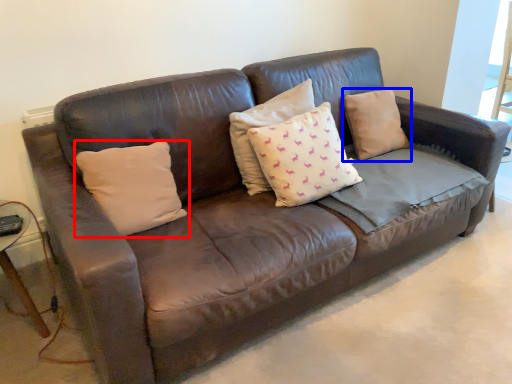
Question: Which object is further to the camera taking this photo, pillow (highlighted by a red box) or pillow (highlighted by a blue box)?

Choices:
 (A) pillow
 (B) pillow

Answer: (B)